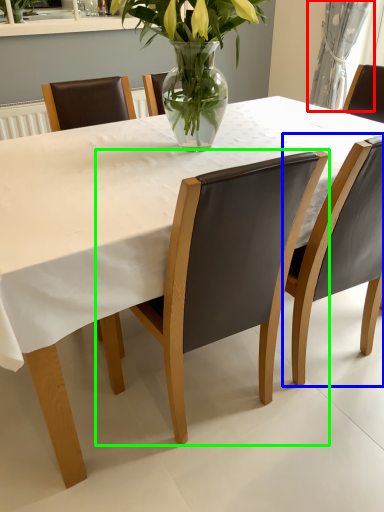
Question: Based on their relative distances, which object is farther from curtain (highlighted by a red box)? Choose from chair (highlighted by a blue box) and chair (highlighted by a green box).

Choices:
 (A) chair
 (B) chair

Answer: (B)